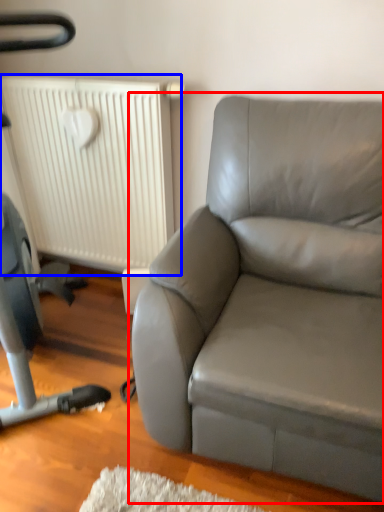
Question: Which point is closer to the camera, studio couch (highlighted by a red box) or radiator (highlighted by a blue box)?

Choices:
 (A) studio couch
 (B) radiator

Answer: (A)